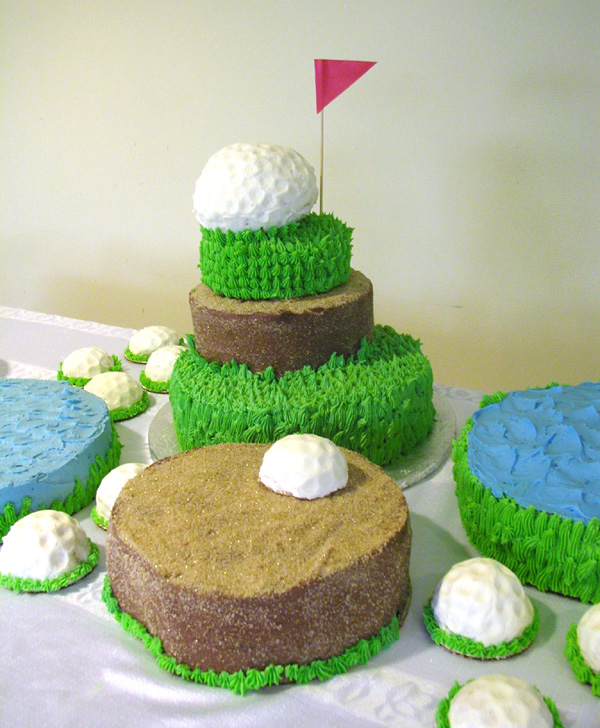
Locate an element on the screen. wall is located at coordinates (180, 114).